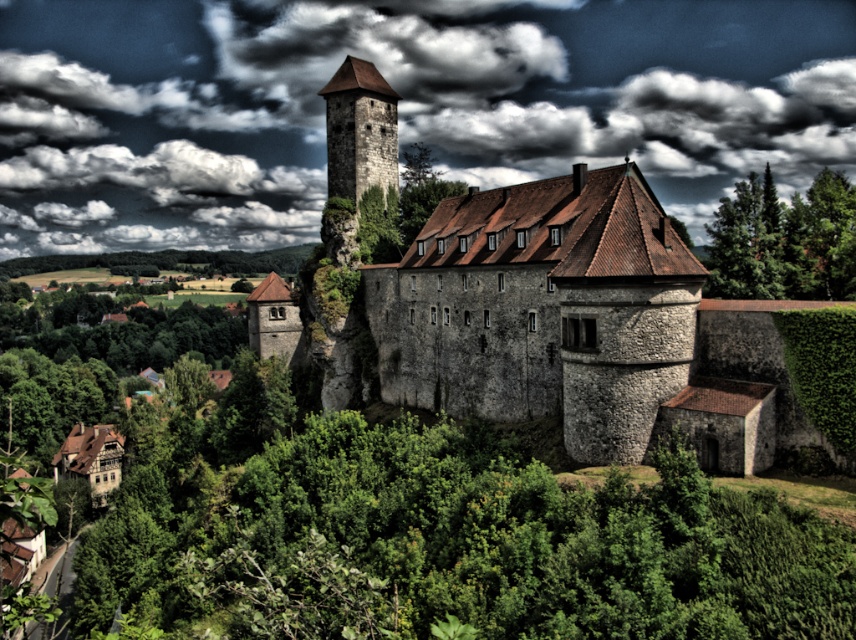
You are an architect analyzing the castle layout. The point marked as point (379, 51) is part of a dark gray cloud at upper center. Where is this dark gray cloud located in relation to the castle?

The dark gray cloud at upper center is located at the upper center of the image, which is above the castle structure.

You are a medieval knight standing in front of the castle. You notice the cloudy sky at upper center and the stone tower at center. Which object is closer to you?

The cloudy sky at upper center is closer to you because the stone tower at center is behind it.